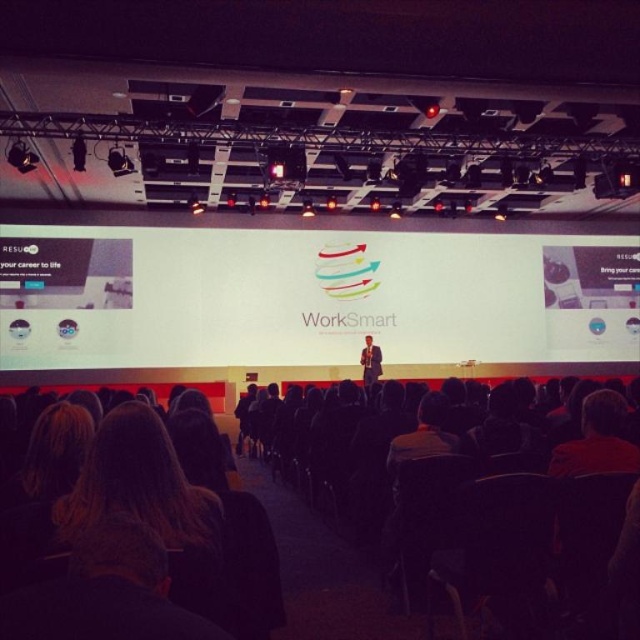
Question: Is white matte projection screen at center positioned at the back of dark suit at center?

Choices:
 (A) yes
 (B) no

Answer: (A)

Question: Which point appears farthest from the camera in this image?

Choices:
 (A) (372, 369)
 (B) (506, 321)

Answer: (B)

Question: Where is white matte projection screen at center located in relation to dark suit at center in the image?

Choices:
 (A) right
 (B) left

Answer: (B)

Question: Which of the following is the closest to the observer?

Choices:
 (A) (260, 339)
 (B) (372, 372)

Answer: (B)

Question: Does white matte projection screen at center have a greater width compared to dark suit at center?

Choices:
 (A) no
 (B) yes

Answer: (B)